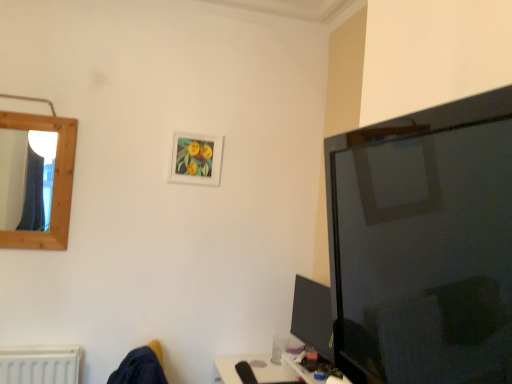
Question: Relative to white matte picture frame at center, is matte black monitor at lower right in front or behind?

Choices:
 (A) behind
 (B) front

Answer: (B)

Question: In terms of height, does matte black monitor at lower right look taller or shorter compared to white matte picture frame at center?

Choices:
 (A) short
 (B) tall

Answer: (B)

Question: Considering the positions of matte black monitor at lower right and white matte picture frame at center in the image, is matte black monitor at lower right wider or thinner than white matte picture frame at center?

Choices:
 (A) thin
 (B) wide

Answer: (B)

Question: From the image's perspective, relative to matte black monitor at lower right, is white matte picture frame at center above or below?

Choices:
 (A) above
 (B) below

Answer: (A)

Question: Considering the positions of white matte picture frame at center and matte black monitor at lower right in the image, is white matte picture frame at center bigger or smaller than matte black monitor at lower right?

Choices:
 (A) big
 (B) small

Answer: (B)

Question: Is white matte picture frame at center taller or shorter than matte black monitor at lower right?

Choices:
 (A) short
 (B) tall

Answer: (A)

Question: In the image, is white matte picture frame at center positioned in front of or behind matte black monitor at lower right?

Choices:
 (A) behind
 (B) front

Answer: (A)